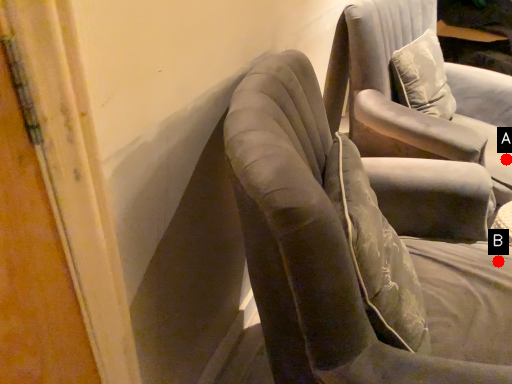
Question: Two points are circled on the image, labeled by A and B beside each circle. Which point is closer to the camera taking this photo?

Choices:
 (A) A is closer
 (B) B is closer

Answer: (B)